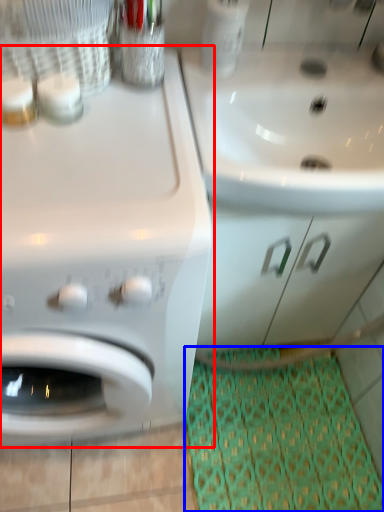
Question: Which of the following is the farthest to the observer, washing machine (highlighted by a red box) or doormat (highlighted by a blue box)?

Choices:
 (A) washing machine
 (B) doormat

Answer: (B)